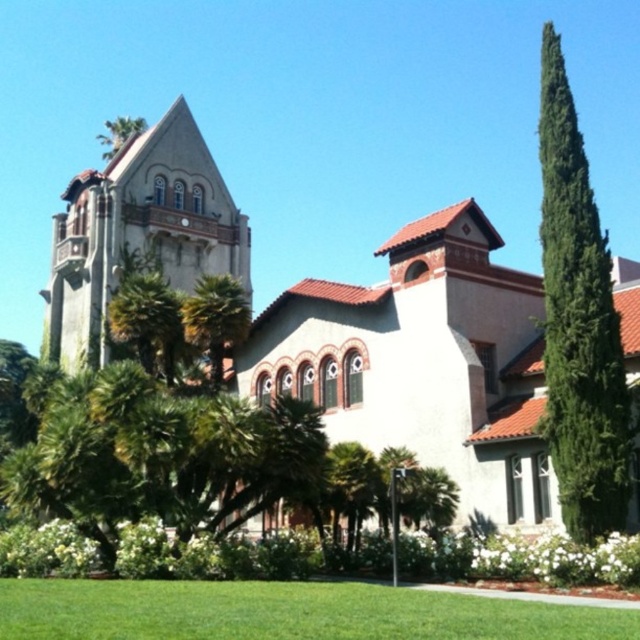
Question: Does white stucco church at center appear on the left side of green leafy palm tree at center?

Choices:
 (A) no
 (B) yes

Answer: (A)

Question: Which object is farther from the camera taking this photo?

Choices:
 (A) green leafy palm tree at center
 (B) rustic stone chapel at upper left

Answer: (B)

Question: Can you confirm if green coniferous tree at right is positioned to the left of green leafy palm tree at center?

Choices:
 (A) yes
 (B) no

Answer: (B)

Question: Among these objects, which one is farthest from the camera?

Choices:
 (A) green grass at lower center
 (B) green leafy palm tree at center
 (C) white stucco church at center
 (D) rustic stone chapel at upper left

Answer: (D)

Question: Which object appears farthest from the camera in this image?

Choices:
 (A) green coniferous tree at right
 (B) green leafy palm tree at center
 (C) white stucco church at center

Answer: (B)

Question: Does green coniferous tree at right lie behind green leafy palm tree at center?

Choices:
 (A) yes
 (B) no

Answer: (B)